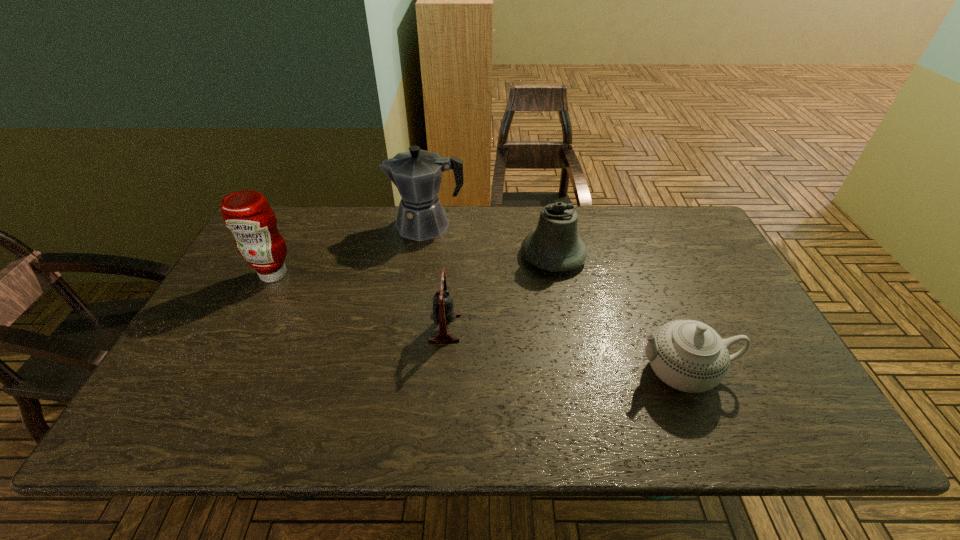
You are a GUI agent. You are given a task and a screenshot of the screen. Output one action in this format:
    pyautogui.click(x=<x>, y=<y>)
    Task: Click on the free space located on the front of the right bell
    
    Given the screenshot: What is the action you would take?
    pyautogui.click(x=573, y=360)

The image size is (960, 540). I want to click on vacant point located on the left of the nearer bell, so click(x=290, y=328).

The width and height of the screenshot is (960, 540). In order to click on free region located on the spout of the chinaware in this screenshot , I will do `click(480, 372)`.

The height and width of the screenshot is (540, 960). I want to click on vacant area situated on the spout of the chinaware, so click(x=573, y=372).

Find the location of `vacant area located 0.200m on the spout of the chinaware`. vacant area located 0.200m on the spout of the chinaware is located at coordinates (547, 372).

Where is `coffeepot situated at the far edge`? coffeepot situated at the far edge is located at coordinates (417, 174).

Locate an element on the screen. Image resolution: width=960 pixels, height=540 pixels. bell that is at the far edge is located at coordinates (554, 246).

The height and width of the screenshot is (540, 960). I want to click on object located at the near edge, so click(688, 355).

Find the location of a particular element. This screenshot has height=540, width=960. object situated at the left edge is located at coordinates (246, 213).

Locate an element on the screen. object that is at the right edge is located at coordinates (688, 355).